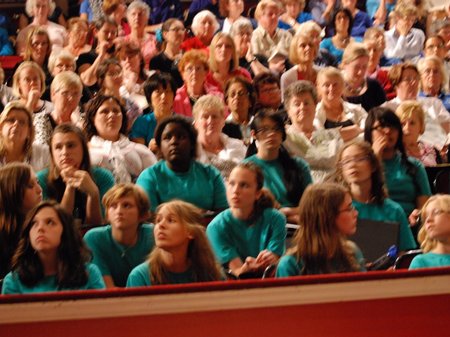
Where is `stage`? stage is located at coordinates (247, 319).